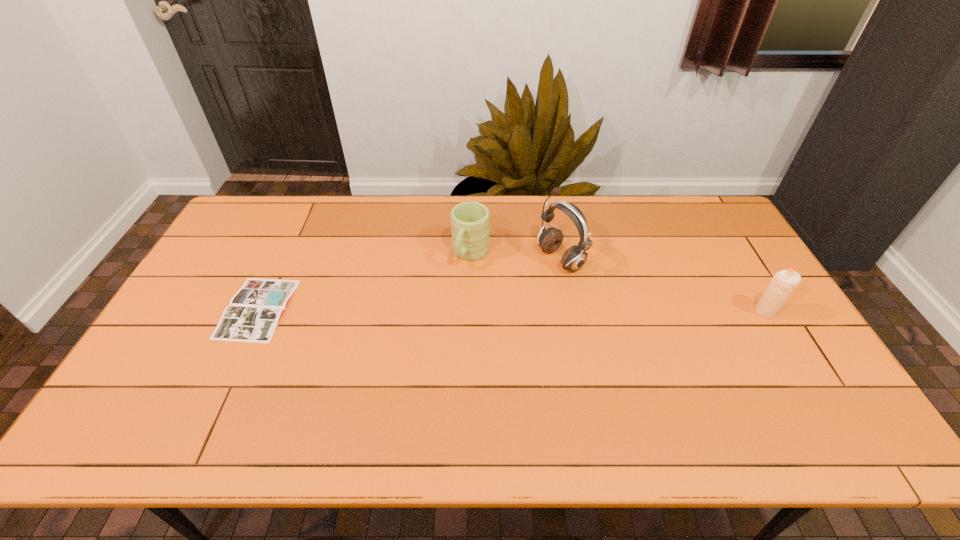
At what (x,y) coordinates should I click in order to perform the action: click on free space between the candle and the third tallest object. Please return your answer as a coordinate pair (x, y). Image resolution: width=960 pixels, height=540 pixels. Looking at the image, I should click on (618, 283).

At what (x,y) coordinates should I click in order to perform the action: click on vacant space that is in between the mug and the book. Please return your answer as a coordinate pair (x, y). Looking at the image, I should click on (364, 281).

Identify the location of vacant point located between the leftmost object and the rightmost object. The height and width of the screenshot is (540, 960). (512, 310).

I want to click on object that ranks as the second closest to the candle, so click(470, 221).

Select which object appears as the second closest to the tallest object. Please provide its 2D coordinates. Your answer should be formatted as a tuple, i.e. [(x, y)], where the tuple contains the x and y coordinates of a point satisfying the conditions above.

[(782, 284)]

This screenshot has width=960, height=540. In order to click on vacant space that satisfies the following two spatial constraints: 1. on the front side of the book; 2. on the left side of the rightmost object in this screenshot , I will do `click(256, 312)`.

You are a GUI agent. You are given a task and a screenshot of the screen. Output one action in this format:
    pyautogui.click(x=<x>, y=<y>)
    Task: Click on the vacant region that satisfies the following two spatial constraints: 1. on the front side of the leftmost object; 2. on the left side of the second tallest object
    The image size is (960, 540).
    Given the screenshot: What is the action you would take?
    pyautogui.click(x=256, y=312)

This screenshot has height=540, width=960. Find the location of `free space that satisfies the following two spatial constraints: 1. on the front side of the third object from right to left; 2. on the left side of the earphone`. free space that satisfies the following two spatial constraints: 1. on the front side of the third object from right to left; 2. on the left side of the earphone is located at coordinates (470, 259).

At what (x,y) coordinates should I click in order to perform the action: click on vacant space that satisfies the following two spatial constraints: 1. on the back side of the book; 2. on the left side of the third object from right to left. Please return your answer as a coordinate pair (x, y). Looking at the image, I should click on (283, 254).